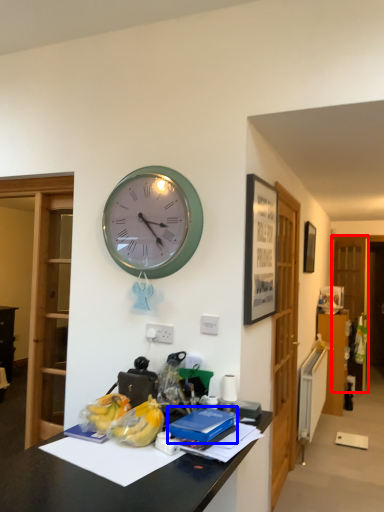
Question: Which object is closer to the camera taking this photo, glass door (highlighted by a red box) or book (highlighted by a blue box)?

Choices:
 (A) glass door
 (B) book

Answer: (B)